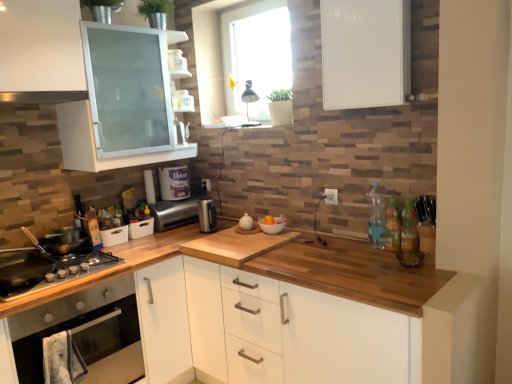
Where is `free space to the back side of clear plastic bottle at right, placed as the first bottle when sorted from left to right`? This screenshot has height=384, width=512. free space to the back side of clear plastic bottle at right, placed as the first bottle when sorted from left to right is located at coordinates (359, 242).